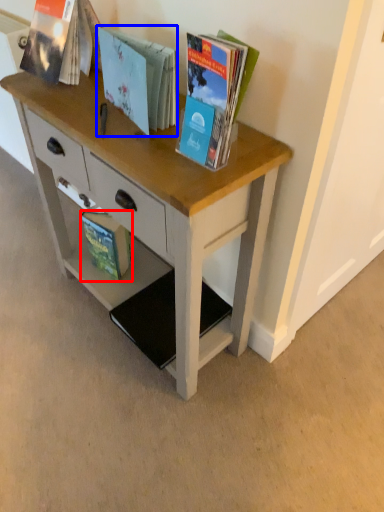
Question: Among these objects, which one is nearest to the camera, book (highlighted by a red box) or book (highlighted by a blue box)?

Choices:
 (A) book
 (B) book

Answer: (B)